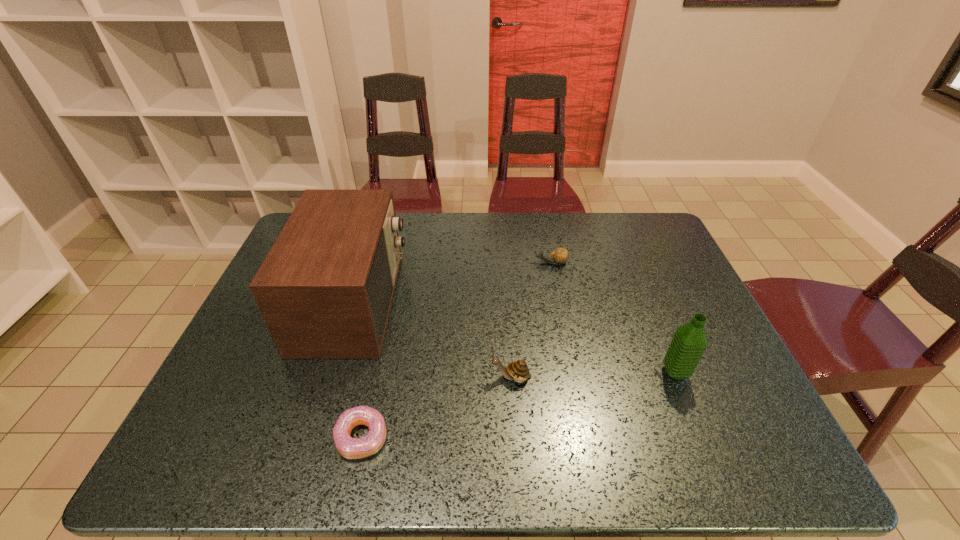
Where is `object present at the right edge`? object present at the right edge is located at coordinates (689, 342).

The image size is (960, 540). In the image, there is a desktop. Identify the location of free space at the far edge. (597, 224).

Locate an element on the screen. Image resolution: width=960 pixels, height=540 pixels. free space at the near edge of the desktop is located at coordinates (300, 458).

Image resolution: width=960 pixels, height=540 pixels. Find the location of `free spot at the right edge of the desktop`. free spot at the right edge of the desktop is located at coordinates (689, 283).

Find the location of a particular element. Image resolution: width=960 pixels, height=540 pixels. vacant space at the near left corner is located at coordinates [205, 464].

Where is `free space at the far right corner of the desktop`? The width and height of the screenshot is (960, 540). free space at the far right corner of the desktop is located at coordinates (660, 253).

You are a GUI agent. You are given a task and a screenshot of the screen. Output one action in this format:
    pyautogui.click(x=<x>, y=<y>)
    Task: Click on the free space at the near right corner of the desktop
    Image resolution: width=960 pixels, height=540 pixels.
    Given the screenshot: What is the action you would take?
    pyautogui.click(x=754, y=447)

At what (x,y) coordinates should I click in order to perform the action: click on free spot between the radio receiver and the water bottle. Please return your answer as a coordinate pair (x, y). The image size is (960, 540). Looking at the image, I should click on (515, 338).

Image resolution: width=960 pixels, height=540 pixels. Identify the location of blank region between the radio receiver and the nearest object. pos(357,369).

Where is `empty space that is in between the radio receiver and the left escargot`? Image resolution: width=960 pixels, height=540 pixels. empty space that is in between the radio receiver and the left escargot is located at coordinates (432, 340).